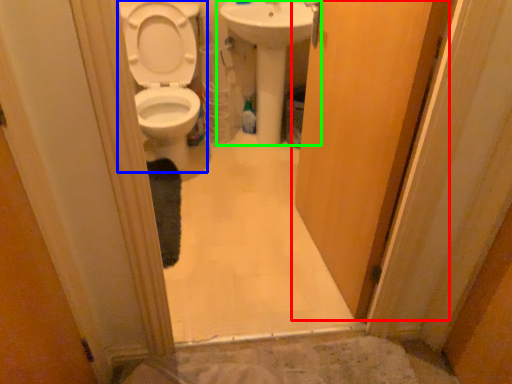
Question: Which is farther away from door (highlighted by a red box)? toilet (highlighted by a blue box) or sink (highlighted by a green box)?

Choices:
 (A) toilet
 (B) sink

Answer: (A)